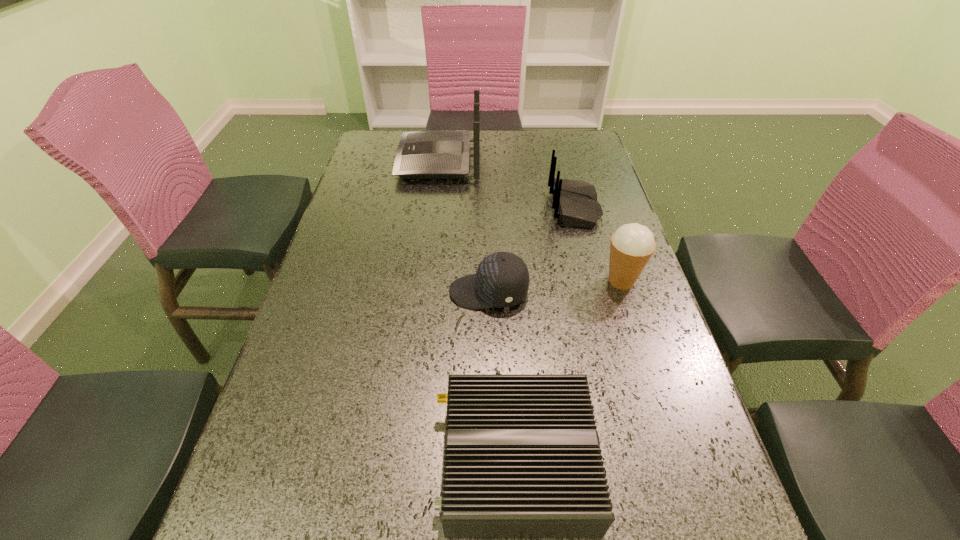
This screenshot has width=960, height=540. Identify the location of the farthest object. click(435, 154).

You are a GUI agent. You are given a task and a screenshot of the screen. Output one action in this format:
    pyautogui.click(x=<x>, y=<y>)
    Task: Click on the farthest router
    This screenshot has height=540, width=960.
    Given the screenshot: What is the action you would take?
    pyautogui.click(x=435, y=154)

Where is `icecream`? The image size is (960, 540). icecream is located at coordinates (632, 245).

You are a GUI agent. You are given a task and a screenshot of the screen. Output one action in this format:
    pyautogui.click(x=<x>, y=<y>)
    Task: Click on the second shortest router
    
    Given the screenshot: What is the action you would take?
    pyautogui.click(x=575, y=202)

Locate an element on the screen. This screenshot has height=540, width=960. the third tallest object is located at coordinates (575, 202).

In order to click on baseball cap in this screenshot , I will do `click(502, 279)`.

Where is `the nearest object`? the nearest object is located at coordinates (522, 459).

At what (x,y) coordinates should I click in order to perform the action: click on the nearest router. Please return your answer as a coordinate pair (x, y). The width and height of the screenshot is (960, 540). Looking at the image, I should click on (522, 459).

At what (x,y) coordinates should I click in order to perform the action: click on blank area located 0.100m on the front-facing side of the tallest router. Please return your answer as a coordinate pair (x, y). The height and width of the screenshot is (540, 960). Looking at the image, I should click on (369, 161).

The width and height of the screenshot is (960, 540). Identify the location of vacant space located 0.120m on the front-facing side of the tallest router. [363, 161].